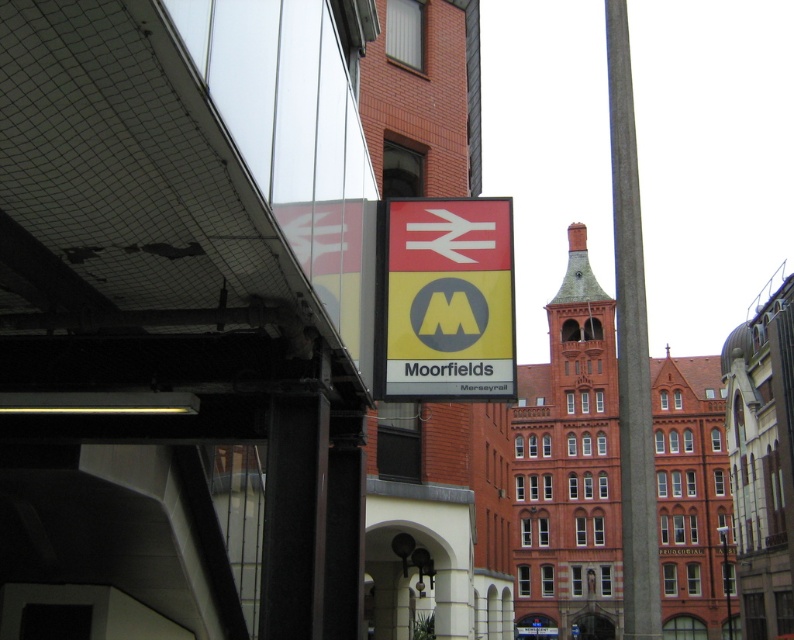
Can you confirm if yellow matte sign at center is taller than concrete pole at right?

No, yellow matte sign at center is not taller than concrete pole at right.

Which is more to the right, yellow matte sign at center or concrete pole at right?

Positioned to the right is concrete pole at right.

Measure the distance between point (461, 280) and camera.

They are 53.01 meters apart.

The image size is (794, 640). What are the coordinates of `yellow matte sign at center` in the screenshot? It's located at (446, 300).